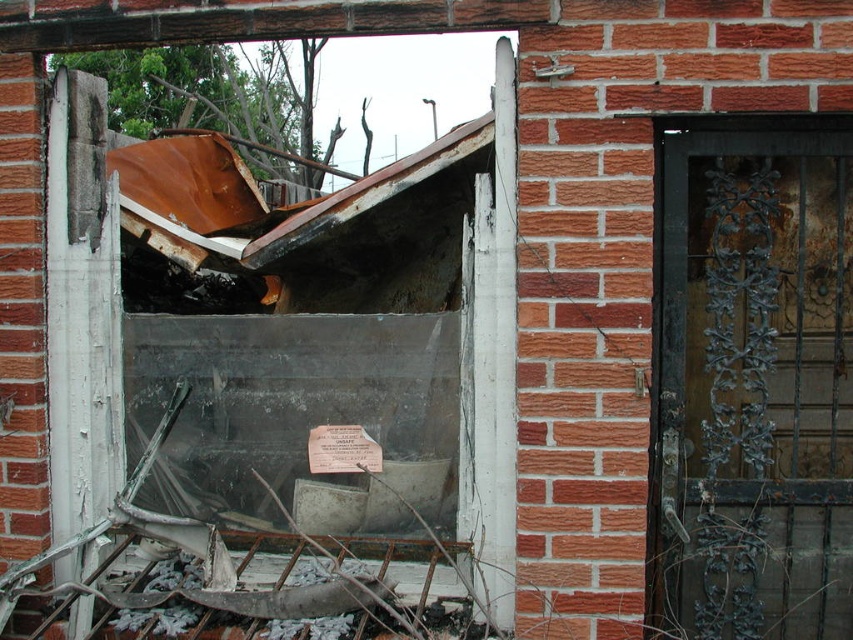
Is point (190, 417) farther from viewer compared to point (735, 385)?

Yes, it is.

Does rusty metal window at center appear over rusty metal door at right?

Yes.

Describe the element at coordinates (299, 353) in the screenshot. I see `rusty metal window at center` at that location.

This screenshot has height=640, width=853. Find the location of `rusty metal window at center`. rusty metal window at center is located at coordinates pyautogui.click(x=299, y=353).